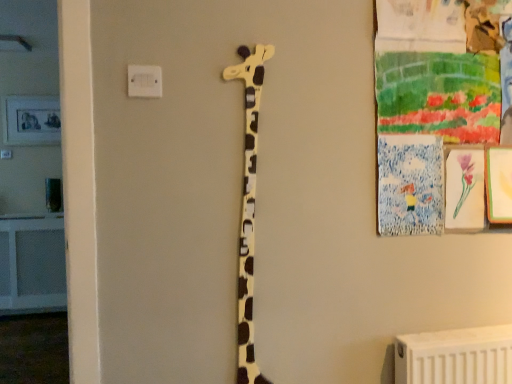
Question: Considering the relative sizes of white plastic electric outlet at upper center and matte yellow giraffe at center in the image provided, is white plastic electric outlet at upper center bigger than matte yellow giraffe at center?

Choices:
 (A) no
 (B) yes

Answer: (A)

Question: Is white plastic electric outlet at upper center in front of matte yellow giraffe at center?

Choices:
 (A) yes
 (B) no

Answer: (A)

Question: Considering the relative sizes of white plastic electric outlet at upper center and matte yellow giraffe at center in the image provided, is white plastic electric outlet at upper center taller than matte yellow giraffe at center?

Choices:
 (A) yes
 (B) no

Answer: (B)

Question: Considering the relative sizes of white plastic electric outlet at upper center and matte yellow giraffe at center in the image provided, is white plastic electric outlet at upper center shorter than matte yellow giraffe at center?

Choices:
 (A) yes
 (B) no

Answer: (A)

Question: Can matte yellow giraffe at center be found inside white plastic electric outlet at upper center?

Choices:
 (A) no
 (B) yes

Answer: (A)

Question: Is white plastic electric outlet at upper center far from matte yellow giraffe at center?

Choices:
 (A) no
 (B) yes

Answer: (A)

Question: Can you confirm if matte yellow giraffe at center is smaller than white plastic electric outlet at upper center?

Choices:
 (A) no
 (B) yes

Answer: (A)

Question: Is matte yellow giraffe at center taller than white plastic electric outlet at upper center?

Choices:
 (A) yes
 (B) no

Answer: (A)

Question: Is matte yellow giraffe at center bigger than white plastic electric outlet at upper center?

Choices:
 (A) no
 (B) yes

Answer: (B)

Question: Is matte yellow giraffe at center positioned with its back to white plastic electric outlet at upper center?

Choices:
 (A) no
 (B) yes

Answer: (A)

Question: Is matte yellow giraffe at center to the right of white plastic electric outlet at upper center from the viewer's perspective?

Choices:
 (A) yes
 (B) no

Answer: (A)

Question: Is matte yellow giraffe at center outside of white plastic electric outlet at upper center?

Choices:
 (A) no
 (B) yes

Answer: (B)

Question: Is matte yellow giraffe at center spatially inside white plastic electric outlet at upper center, or outside of it?

Choices:
 (A) inside
 (B) outside

Answer: (B)